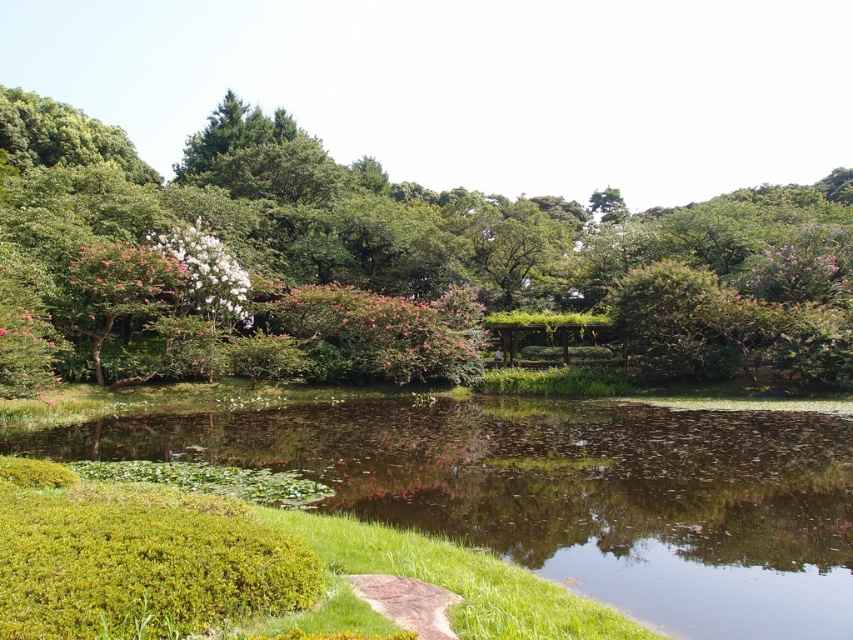
Is green leafy tree at center above green grassy lake at lower left?

Correct, green leafy tree at center is located above green grassy lake at lower left.

What do you see at coordinates (390, 260) in the screenshot?
I see `green leafy tree at center` at bounding box center [390, 260].

At what (x,y) coordinates should I click in order to perform the action: click on green leafy tree at center. Please return your answer as a coordinate pair (x, y). Looking at the image, I should click on (390, 260).